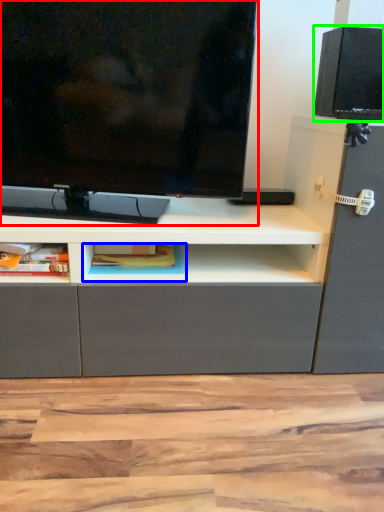
Question: Which is farther away from television (highlighted by a red box)? cabinet (highlighted by a blue box) or speaker (highlighted by a green box)?

Choices:
 (A) cabinet
 (B) speaker

Answer: (B)